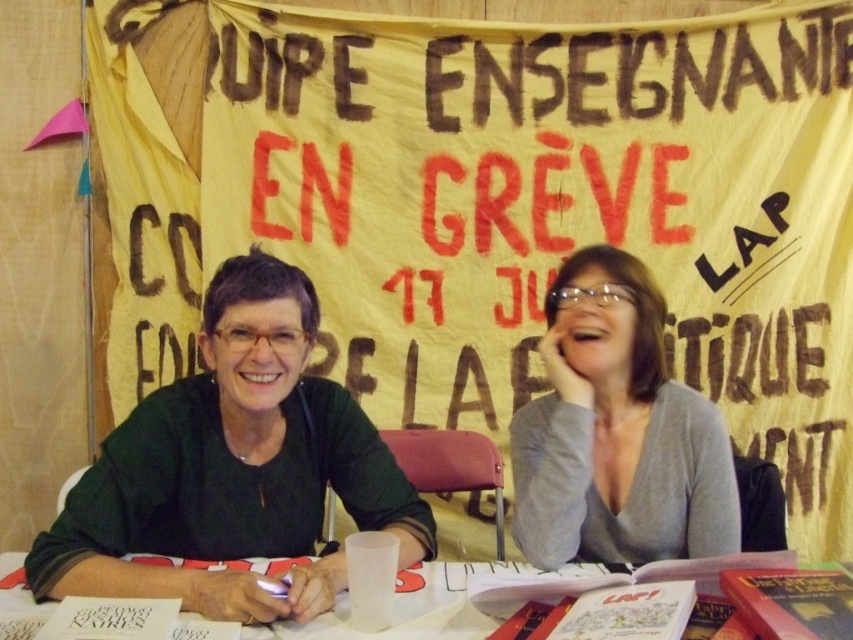
You are a photographer standing in front of the scene described. You notice the green matte shirt at center and the white plastic table at center. Which object is taller? Please answer based on the scene description.

The green matte shirt at center is taller than the white plastic table at center according to the scene description.